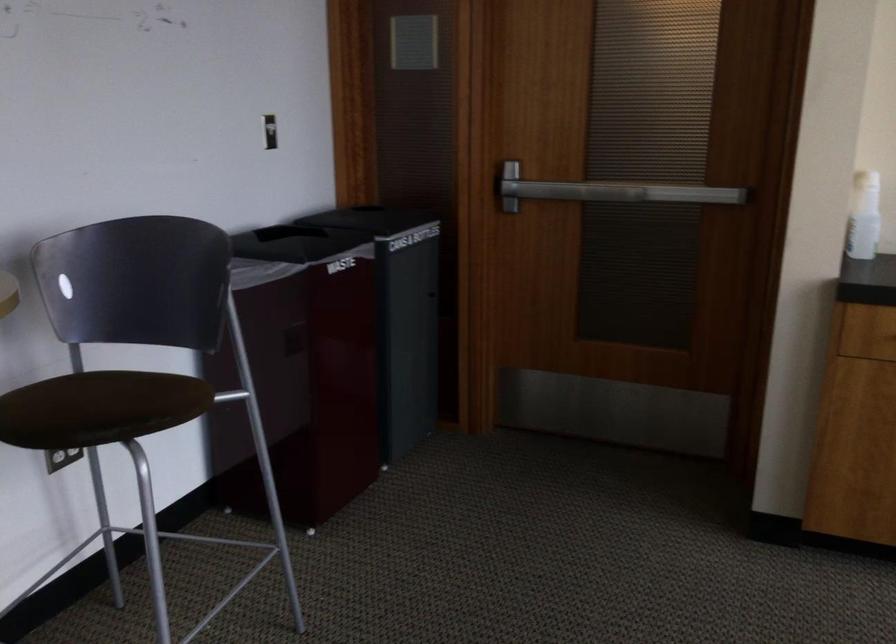
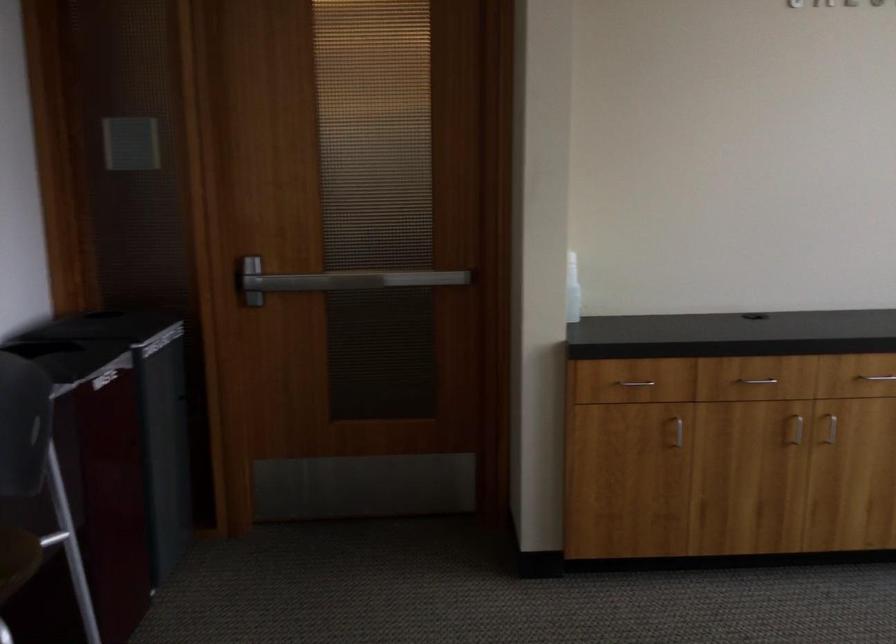
In the second image, find the point that corresponds to (606,194) in the first image.

(354, 279)